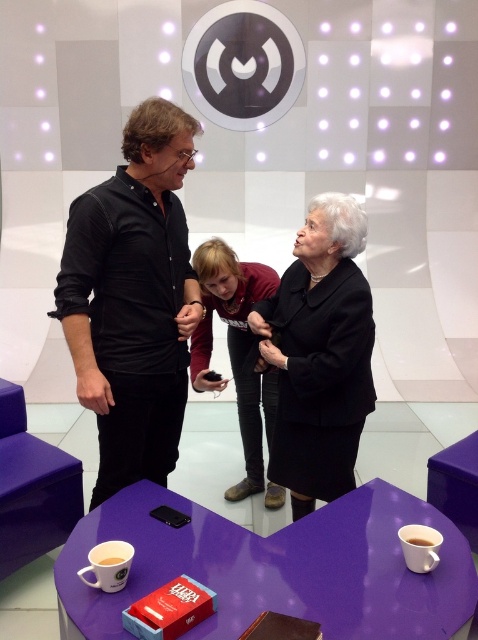
Question: Is the position of purple glossy table at lower center less distant than that of matte brown leather jacket at center?

Choices:
 (A) yes
 (B) no

Answer: (A)

Question: Which of the following is the farthest from the observer?

Choices:
 (A) white paper cup at lower left
 (B) matte brown leather jacket at center
 (C) black matte shirt at center
 (D) white matte cup at lower center

Answer: (B)

Question: Is black matte shirt at center to the left of white ceramic mug at lower right from the viewer's perspective?

Choices:
 (A) yes
 (B) no

Answer: (A)

Question: Which object appears farthest from the camera in this image?

Choices:
 (A) white matte cup at lower center
 (B) black matte coat at center

Answer: (B)

Question: Estimate the real-world distances between objects in this image. Which object is farther from the black matte shirt at center?

Choices:
 (A) matte brown leather jacket at center
 (B) white matte cup at lower center
 (C) purple glossy table at lower center
 (D) white ceramic mug at lower right

Answer: (D)

Question: Does black matte shirt at center lie behind white matte cup at lower center?

Choices:
 (A) yes
 (B) no

Answer: (A)